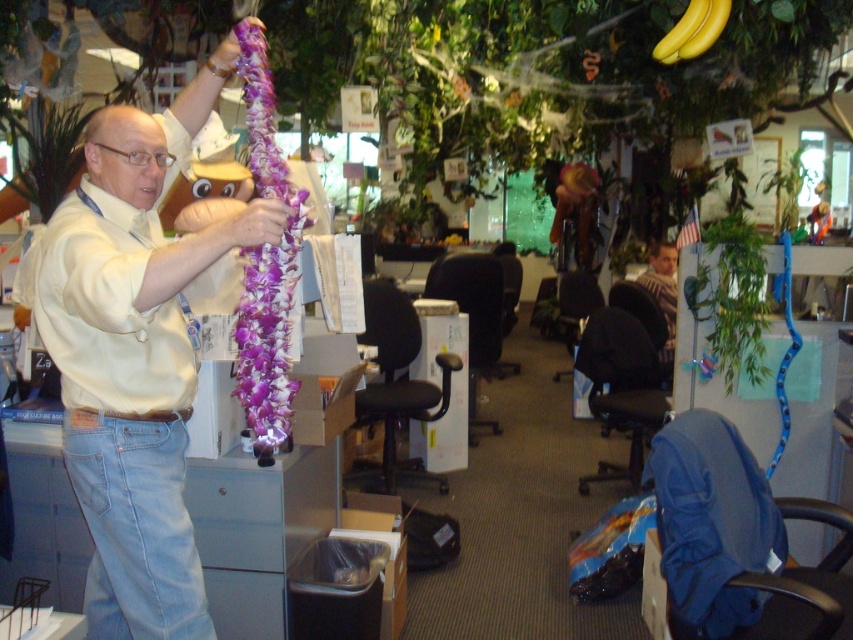
Is matte white shirt at left shorter than light blue denim jeans at lower left?

Incorrect, matte white shirt at left's height does not fall short of light blue denim jeans at lower left's.

Who is shorter, matte white shirt at left or light blue denim jeans at lower left?

light blue denim jeans at lower left

This screenshot has height=640, width=853. What are the coordinates of `matte white shirt at left` in the screenshot? It's located at (135, 356).

Is yellow smooth bananas at upper center shorter than striped sweater at center?

Yes, yellow smooth bananas at upper center is shorter than striped sweater at center.

In order to click on yellow smooth bananas at upper center in this screenshot , I will do `click(693, 29)`.

Locate an element on the screen. Image resolution: width=853 pixels, height=640 pixels. yellow smooth bananas at upper center is located at coordinates (693, 29).

The width and height of the screenshot is (853, 640). Find the location of `matte white shirt at left`. matte white shirt at left is located at coordinates pyautogui.click(x=135, y=356).

I want to click on matte white shirt at left, so click(x=135, y=356).